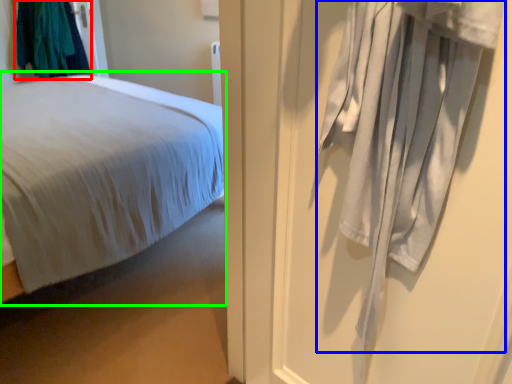
Question: Which object is the farthest from clothing (highlighted by a red box)? Choose among these: curtain (highlighted by a blue box) or bed (highlighted by a green box).

Choices:
 (A) curtain
 (B) bed

Answer: (A)